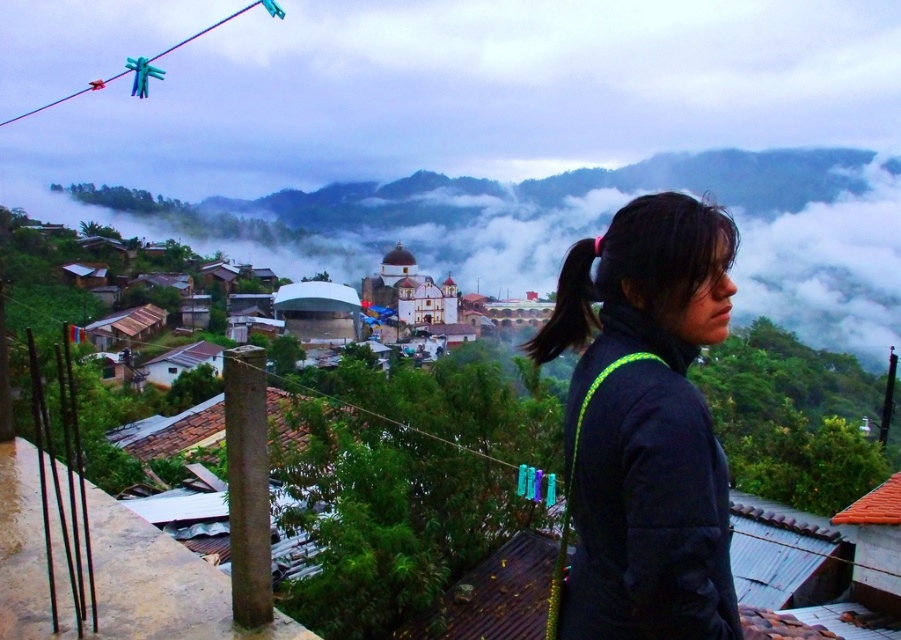
You are a photographer trying to capture the best shot of the black fleece jacket at right and the black hair at right. Which object should you focus on first to ensure both are in sharp focus?

The black fleece jacket at right is closer to the viewer than the black hair at right. To ensure both are in sharp focus, you should focus on the black fleece jacket at right first, as it is closer, and the depth of field will naturally include the black hair at right which is farther away.

You are a photographer trying to capture the person in the scene. Since the black fleece jacket at right and the black hair at right are both dark, which one will be easier to see in the photo due to their thickness?

The black fleece jacket at right is thinner than the black hair at right, so the black hair at right will be easier to see in the photo because it is thicker and more distinct against the background.

In the scene shown: You are a photographer trying to capture the person in the scene. You notice the black fleece jacket at right and the black hair at right. Which object is closer to the left edge of the photo?

The black fleece jacket at right is positioned on the left side of the black hair at right, so the black fleece jacket at right is closer to the left edge of the photo.